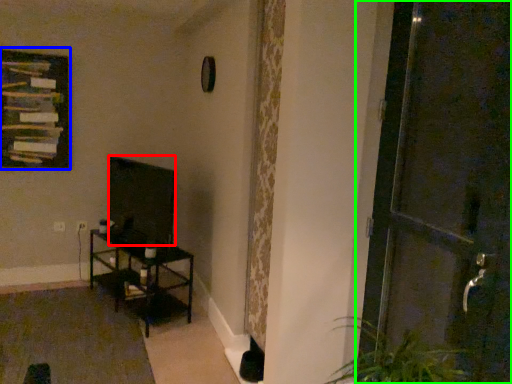
Question: Which object is positioned closest to wide (highlighted by a red box)? Select from picture frame (highlighted by a blue box) and door (highlighted by a green box).

Choices:
 (A) picture frame
 (B) door

Answer: (A)